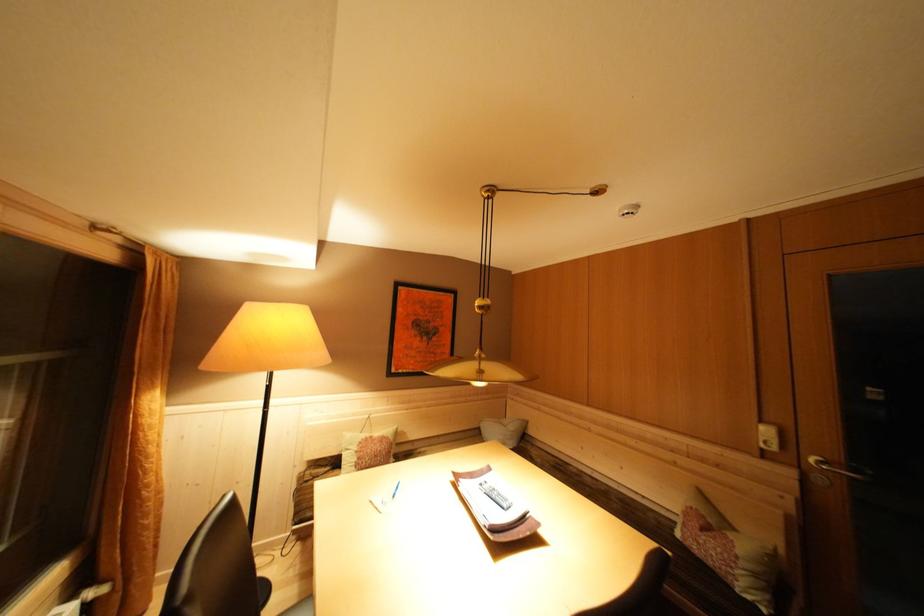
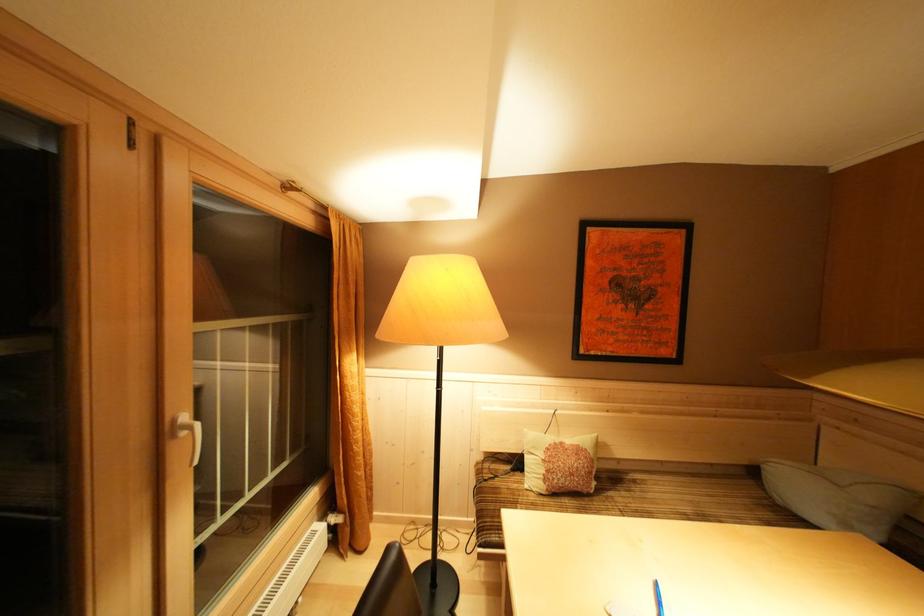
Where in the second image is the point corresponding to the point at 160,392 from the first image?

(358, 357)